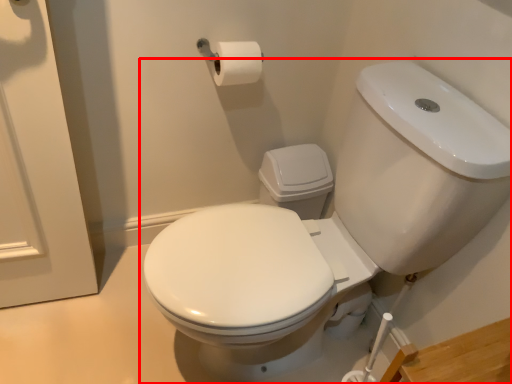
Question: From the image's perspective, what is the correct spatial relationship of toilet (annotated by the red box) in relation to toilet paper?

Choices:
 (A) below
 (B) above

Answer: (A)